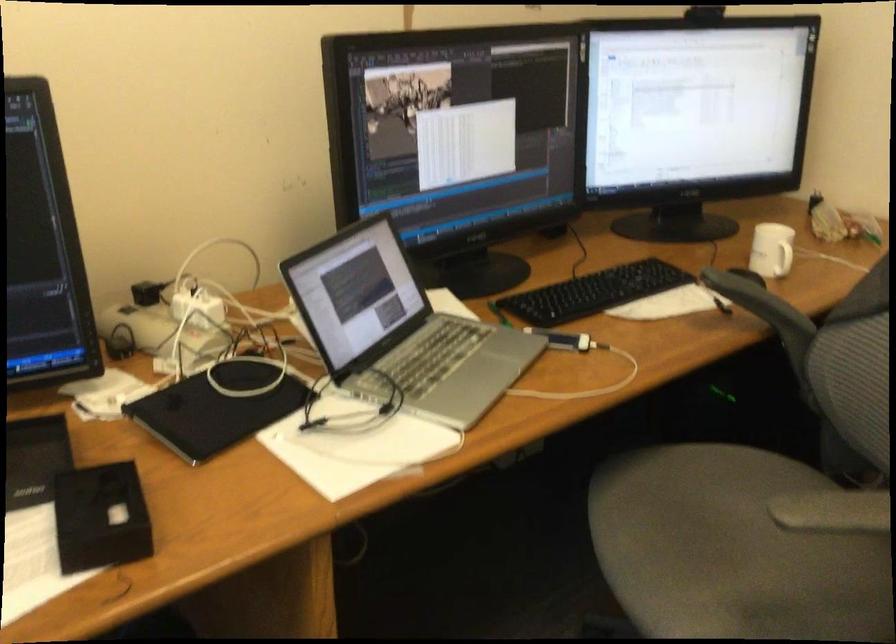
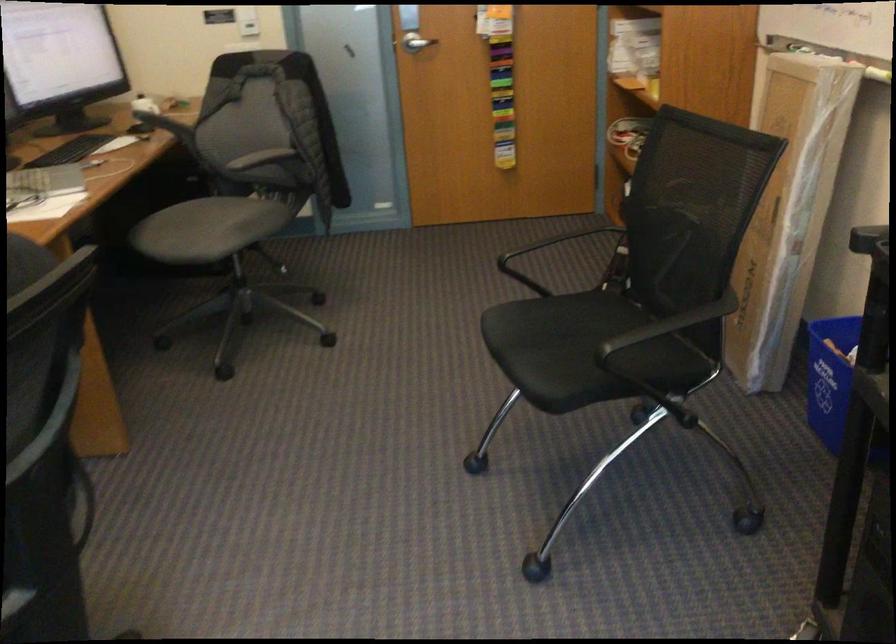
Locate, in the second image, the point that corresponds to [700,556] in the first image.

(207, 229)